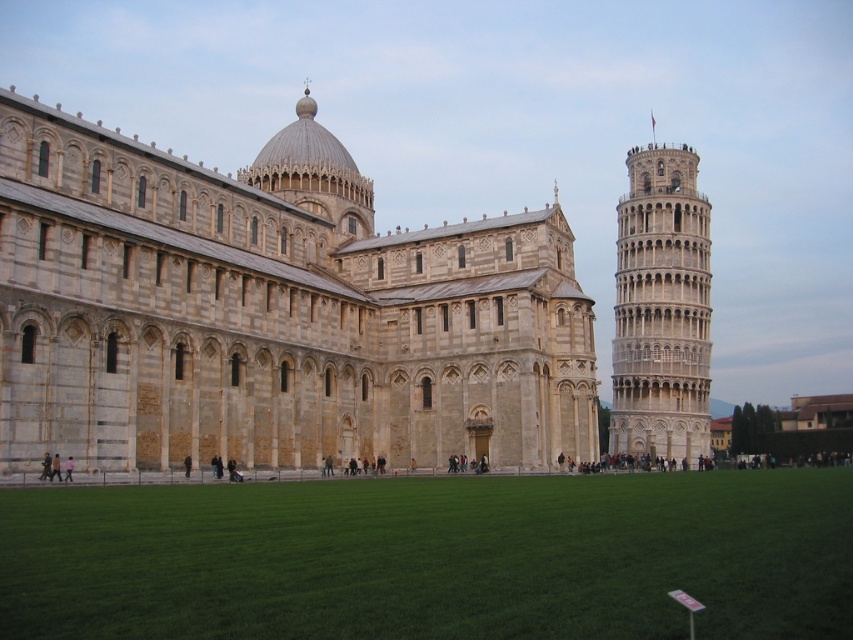
Question: Can you confirm if light beige stone cathedral at center is bigger than light beige stone tower at right?

Choices:
 (A) no
 (B) yes

Answer: (B)

Question: Among these objects, which one is farthest from the camera?

Choices:
 (A) light beige stone tower at right
 (B) light beige stone cathedral at center

Answer: (A)

Question: Which point is farther from the camera taking this photo?

Choices:
 (A) (509, 451)
 (B) (654, 204)

Answer: (B)

Question: Can you confirm if light beige stone cathedral at center is thinner than light beige stone tower at right?

Choices:
 (A) no
 (B) yes

Answer: (A)

Question: Does light beige stone cathedral at center come behind light beige stone tower at right?

Choices:
 (A) yes
 (B) no

Answer: (B)